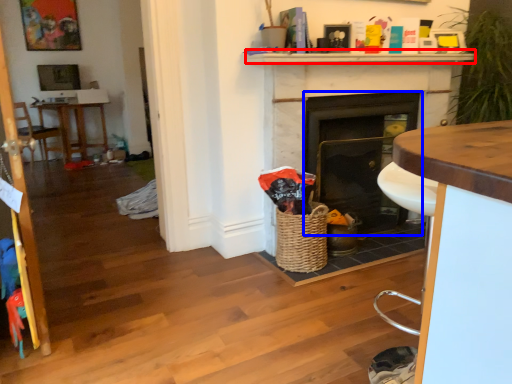
Question: Which object appears farthest to the camera in this image, mantle (highlighted by a red box) or fireplace (highlighted by a blue box)?

Choices:
 (A) mantle
 (B) fireplace

Answer: (B)